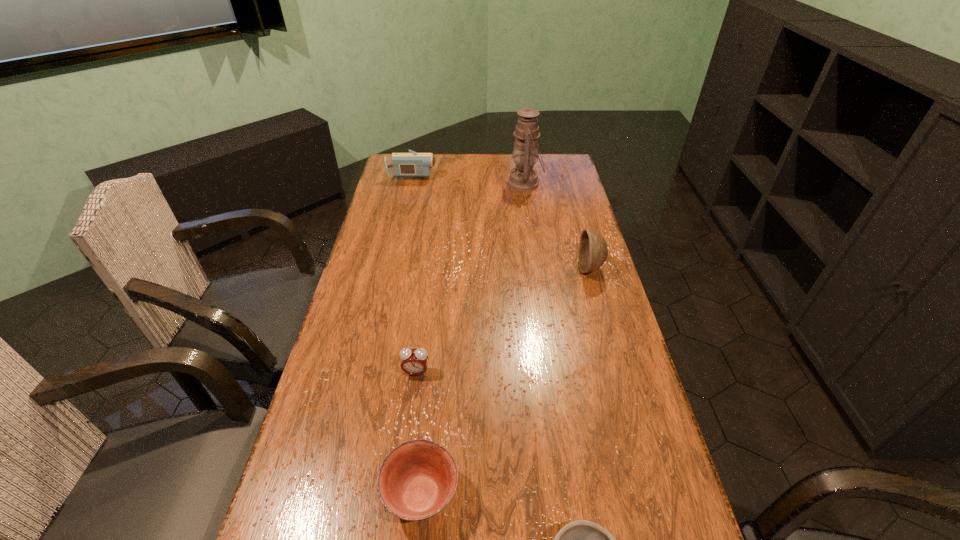
Where is `the tallest object`? This screenshot has height=540, width=960. the tallest object is located at coordinates (523, 178).

Find the location of a particular element. Image resolution: width=960 pixels, height=540 pixels. the rightmost bowl is located at coordinates (593, 250).

This screenshot has width=960, height=540. I want to click on the fourth nearest object, so click(x=593, y=250).

Locate an element on the screen. This screenshot has width=960, height=540. camcorder is located at coordinates (412, 164).

Where is `the fourth farthest object`? the fourth farthest object is located at coordinates (414, 361).

This screenshot has height=540, width=960. I want to click on the second shortest object, so click(x=417, y=479).

The image size is (960, 540). I want to click on the second shortest bowl, so click(417, 479).

This screenshot has height=540, width=960. I want to click on vacant position located 0.100m on the left of the oil lamp, so click(484, 183).

Find the location of `vacant region located 0.260m on the back of the farthest bowl`. vacant region located 0.260m on the back of the farthest bowl is located at coordinates (574, 212).

This screenshot has width=960, height=540. In order to click on free space located on the side of the camcorder with the flip-out screen in this screenshot , I will do `click(471, 173)`.